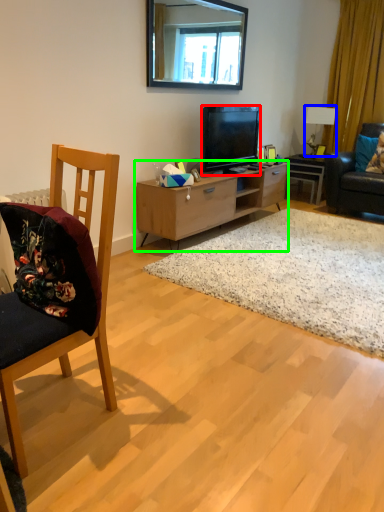
Question: Estimate the real-world distances between objects in this image. Which object is farther from television (highlighted by a red box), lamp (highlighted by a blue box) or cabinetry (highlighted by a green box)?

Choices:
 (A) lamp
 (B) cabinetry

Answer: (A)